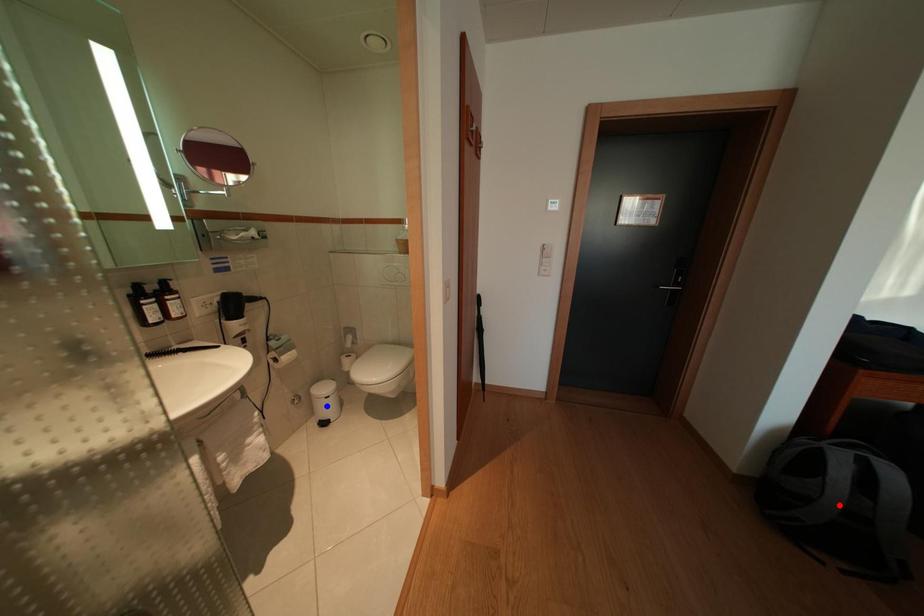
Question: Two points are marked on the image. Which point is closer to the camera?

Choices:
 (A) Blue point is closer.
 (B) Red point is closer.

Answer: (B)